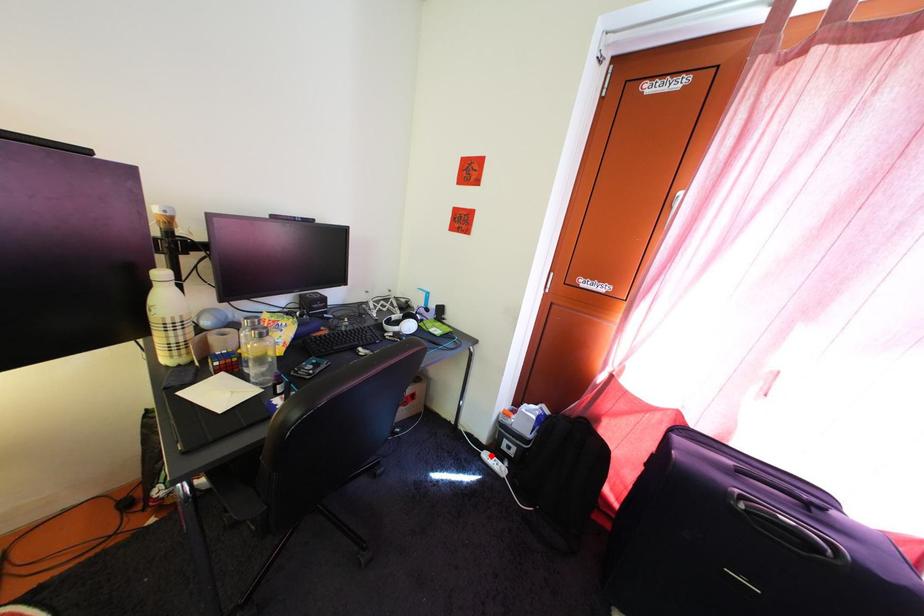
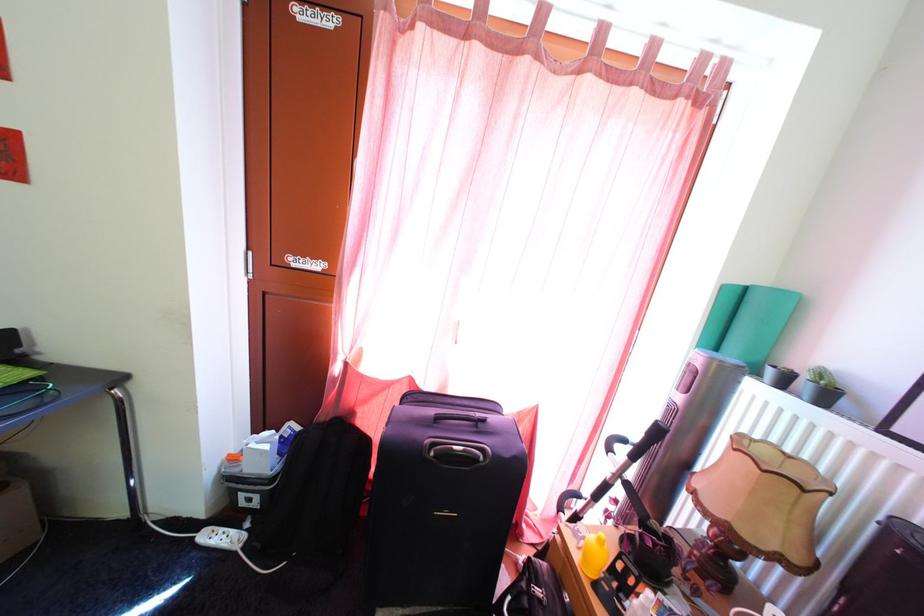
Question: A red point is marked in image1. In image2, is the corresponding 3D point closer to the camera or farther? Reply with the corresponding letter.

Choices:
 (A) The corresponding 3D point is closer.
 (B) The corresponding 3D point is farther.

Answer: (A)